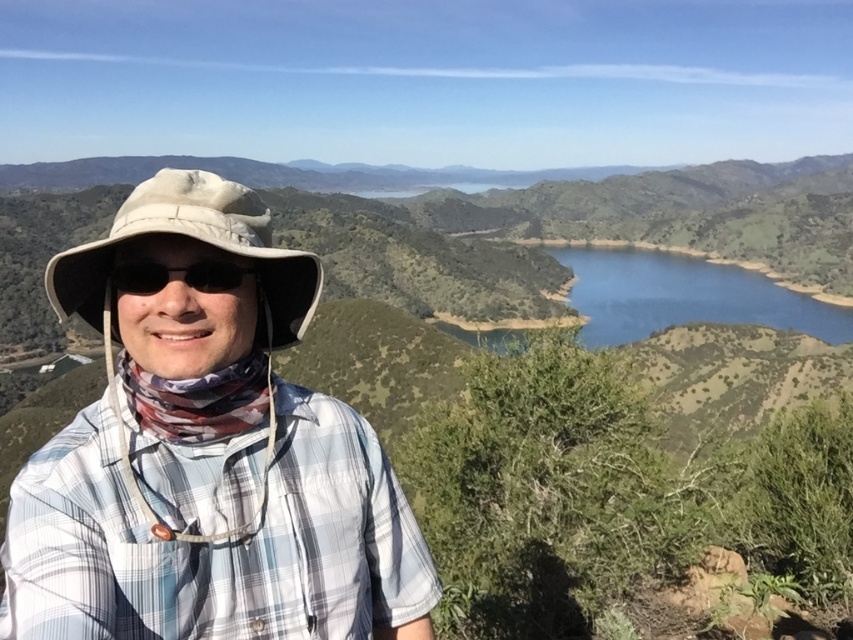
Question: Can you confirm if plaid cotton shirt at center is thinner than beige fabric hat at center?

Choices:
 (A) yes
 (B) no

Answer: (A)

Question: Does tan fabric hat at center have a smaller size compared to blue glossy water at center?

Choices:
 (A) no
 (B) yes

Answer: (B)

Question: Which of the following is the farthest from the observer?

Choices:
 (A) tan fabric hat at center
 (B) blue glossy water at center
 (C) beige fabric hat at center
 (D) plaid cotton shirt at center

Answer: (B)

Question: Which point appears closest to the camera in this image?

Choices:
 (A) (181, 170)
 (B) (318, 632)

Answer: (A)

Question: Which object is the closest to the beige fabric hat at center?

Choices:
 (A) black matte sunglasses at center
 (B) blue glossy water at center
 (C) plaid cotton shirt at center
 (D) tan fabric hat at center

Answer: (D)

Question: Does tan fabric hat at center lie in front of black matte sunglasses at center?

Choices:
 (A) no
 (B) yes

Answer: (B)